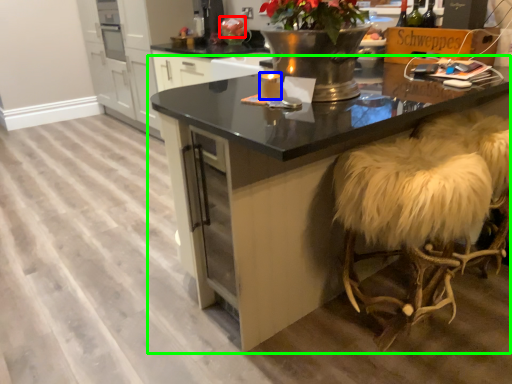
Question: Based on their relative distances, which object is nearer to flower (highlighted by a red box)? Choose from candle (highlighted by a blue box) and table (highlighted by a green box).

Choices:
 (A) candle
 (B) table

Answer: (A)